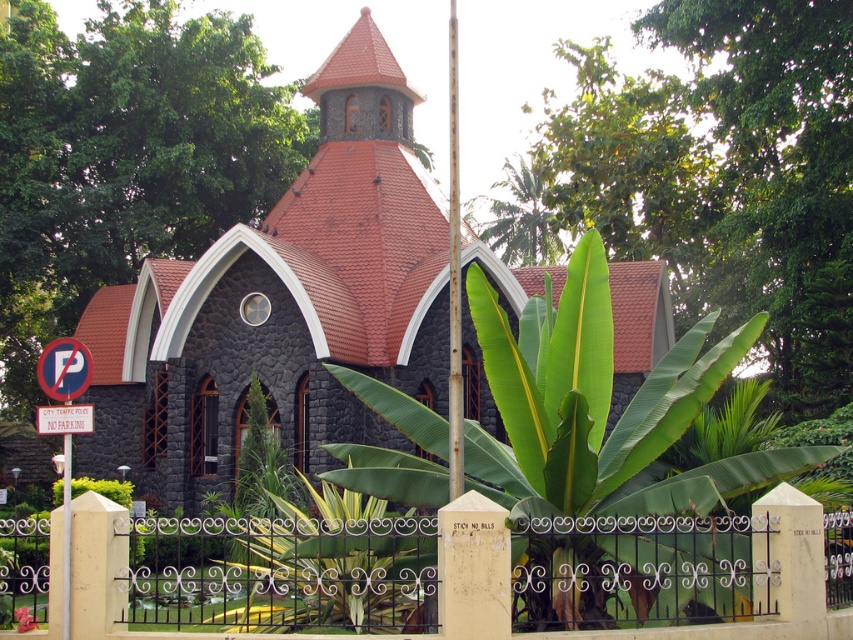
Question: Which point appears closest to the camera in this image?

Choices:
 (A) (450, 412)
 (B) (271, 412)
 (C) (469, 586)

Answer: (C)

Question: Is iron/textured fence at center further to camera compared to smooth white flag pole at center?

Choices:
 (A) no
 (B) yes

Answer: (A)

Question: Which object is closer to the camera taking this photo?

Choices:
 (A) dark gray stone church at center
 (B) smooth white flag pole at center

Answer: (B)

Question: Does dark gray stone church at center appear on the left side of iron/textured fence at center?

Choices:
 (A) no
 (B) yes

Answer: (A)

Question: Does iron/textured fence at center lie behind smooth white flag pole at center?

Choices:
 (A) yes
 (B) no

Answer: (B)

Question: Which of the following is the farthest from the observer?

Choices:
 (A) (456, 266)
 (B) (338, 122)

Answer: (B)